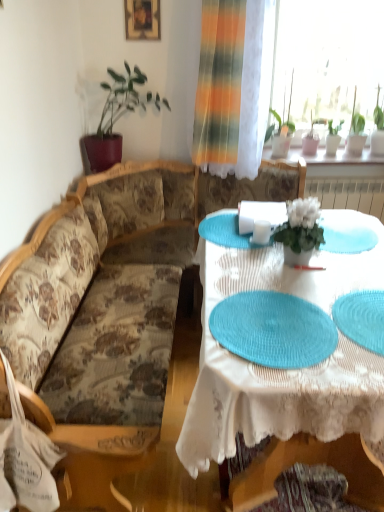
At what (x,y) coordinates should I click in order to perform the action: click on space that is in front of white matte flower pot at center, placed as the first houseplant when sorted from front to back. Please return your answer as a coordinate pair (x, y). Image resolution: width=384 pixels, height=512 pixels. Looking at the image, I should click on click(311, 281).